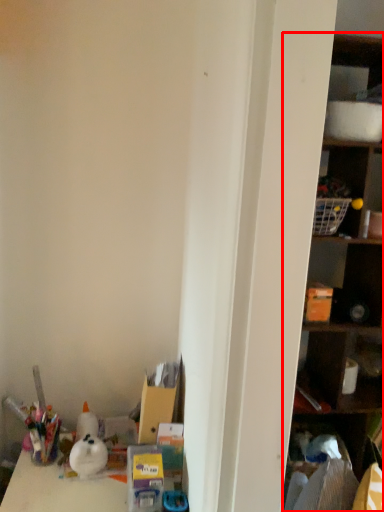
Question: Considering the relative positions of shelf (annotated by the red box) and cabinet in the image provided, where is shelf (annotated by the red box) located with respect to the staircase?

Choices:
 (A) left
 (B) right

Answer: (B)